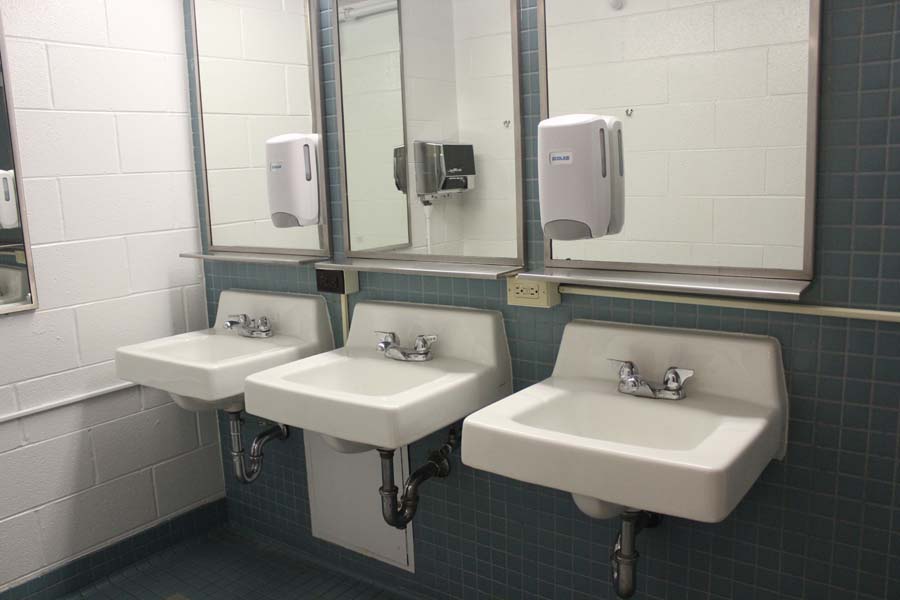
Where is `gray tile`? gray tile is located at coordinates (866, 129).